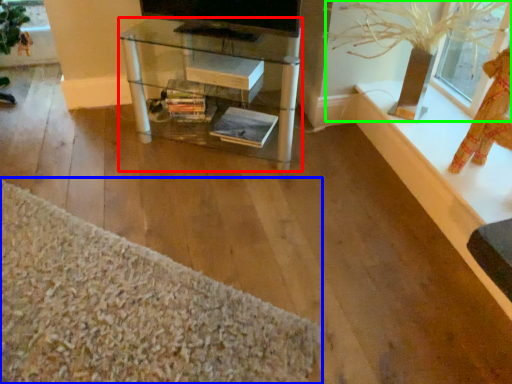
Question: Estimate the real-world distances between objects in this image. Which object is closer to table (highlighted by a red box), plain (highlighted by a blue box) or plant (highlighted by a green box)?

Choices:
 (A) plain
 (B) plant

Answer: (B)